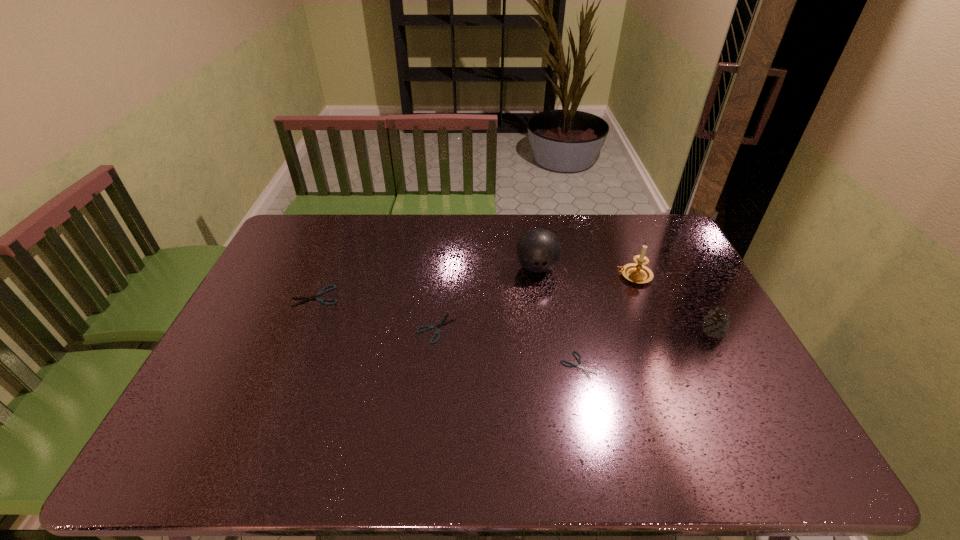
Identify the location of the leftmost object. (334, 286).

The width and height of the screenshot is (960, 540). I want to click on the leftmost shears, so click(334, 286).

Identify the location of the second nearest shears. The height and width of the screenshot is (540, 960). (442, 323).

I want to click on the second shortest shears, so (x=442, y=323).

At what (x,y) coordinates should I click in order to perform the action: click on the nearest shears. Please return your answer as a coordinate pair (x, y). The height and width of the screenshot is (540, 960). Looking at the image, I should click on (579, 360).

The width and height of the screenshot is (960, 540). Find the location of `the shortest shears`. the shortest shears is located at coordinates (579, 360).

Locate an element on the screen. Image resolution: width=960 pixels, height=540 pixels. candle holder is located at coordinates (638, 273).

This screenshot has width=960, height=540. What are the coordinates of `bowling ball` in the screenshot? It's located at (538, 250).

Locate an element on the screen. Image resolution: width=960 pixels, height=540 pixels. pinecone is located at coordinates (715, 324).

Locate an element on the screen. The image size is (960, 540). the rightmost object is located at coordinates (715, 324).